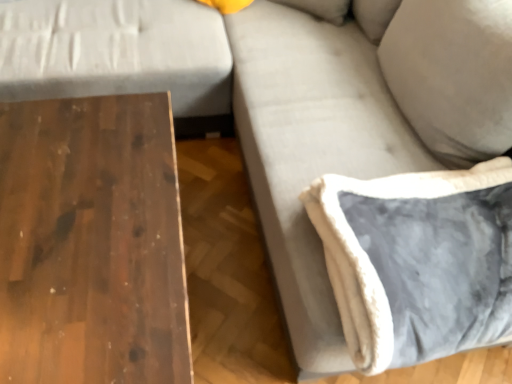
Identify the location of velvet gray pillow at lower right. (418, 261).

In order to face velvet gray pillow at lower right, should I rotate leftwards or rightwards?

Turn right by 24.224 degrees to look at velvet gray pillow at lower right.

What do you see at coordinates (418, 261) in the screenshot? Image resolution: width=512 pixels, height=384 pixels. I see `velvet gray pillow at lower right` at bounding box center [418, 261].

Consider the image. In order to face dark wood table at left, should I rotate leftwards or rightwards?

Rotate your view left by about 23.873°.

What is the approximate width of dark wood table at left?

dark wood table at left is 34.92 inches wide.

What do you see at coordinates (91, 243) in the screenshot? The height and width of the screenshot is (384, 512). I see `dark wood table at left` at bounding box center [91, 243].

The height and width of the screenshot is (384, 512). In order to click on dark wood table at left in this screenshot , I will do `click(91, 243)`.

Identify the location of velvet gray pillow at lower right. The image size is (512, 384). (418, 261).

Which object is positioned more to the left, velvet gray pillow at lower right or dark wood table at left?

From the viewer's perspective, dark wood table at left appears more on the left side.

Considering the relative positions of velvet gray pillow at lower right and dark wood table at left in the image provided, is velvet gray pillow at lower right behind dark wood table at left?

Yes, it is.

Considering the positions of point (490, 308) and point (120, 372), is point (490, 308) closer or farther from the camera than point (120, 372)?

Point (490, 308) appears to be farther away from the viewer than point (120, 372).

From the image's perspective, would you say velvet gray pillow at lower right is positioned over dark wood table at left?

Yes, from the image's perspective, velvet gray pillow at lower right is on top of dark wood table at left.

From a real-world perspective, which is physically below, velvet gray pillow at lower right or dark wood table at left?

dark wood table at left is physically lower.

Considering the sizes of objects velvet gray pillow at lower right and dark wood table at left in the image provided, who is thinner, velvet gray pillow at lower right or dark wood table at left?

With smaller width is velvet gray pillow at lower right.

Is velvet gray pillow at lower right taller than dark wood table at left?

No, velvet gray pillow at lower right is not taller than dark wood table at left.

Considering the relative sizes of velvet gray pillow at lower right and dark wood table at left in the image provided, is velvet gray pillow at lower right bigger than dark wood table at left?

Actually, velvet gray pillow at lower right might be smaller than dark wood table at left.

Can we say velvet gray pillow at lower right lies outside dark wood table at left?

Yes, velvet gray pillow at lower right is located beyond the bounds of dark wood table at left.

Is velvet gray pillow at lower right in contact with dark wood table at left?

There is a gap between velvet gray pillow at lower right and dark wood table at left.

Is velvet gray pillow at lower right facing away from dark wood table at left?

A: velvet gray pillow at lower right is not turned away from dark wood table at left.

What's the angular difference between velvet gray pillow at lower right and dark wood table at left's facing directions?

They differ by 1.59 degrees in their facing directions.

This screenshot has width=512, height=384. Identify the location of table on the left of the velvet gray pillow at lower right. (91, 243).

Does dark wood table at left appear on the right side of velvet gray pillow at lower right?

No, dark wood table at left is not to the right of velvet gray pillow at lower right.

Is the position of dark wood table at left less distant than that of velvet gray pillow at lower right?

Yes, it is in front of velvet gray pillow at lower right.

Is point (74, 265) positioned behind point (480, 163)?

No, it is in front of (480, 163).

From the image's perspective, is dark wood table at left located above or below velvet gray pillow at lower right?

dark wood table at left is situated lower than velvet gray pillow at lower right in the image.

From a real-world perspective, is dark wood table at left over velvet gray pillow at lower right?

No, from a real-world perspective, dark wood table at left is not on top of velvet gray pillow at lower right.

Considering the sizes of objects dark wood table at left and velvet gray pillow at lower right in the image provided, who is thinner, dark wood table at left or velvet gray pillow at lower right?

Thinner between the two is velvet gray pillow at lower right.

Considering the relative sizes of dark wood table at left and velvet gray pillow at lower right in the image provided, is dark wood table at left taller than velvet gray pillow at lower right?

Correct, dark wood table at left is much taller as velvet gray pillow at lower right.

Does dark wood table at left have a smaller size compared to velvet gray pillow at lower right?

Incorrect, dark wood table at left is not smaller in size than velvet gray pillow at lower right.

Is dark wood table at left inside or outside of velvet gray pillow at lower right?

dark wood table at left is spatially situated outside velvet gray pillow at lower right.

Would you consider dark wood table at left to be distant from velvet gray pillow at lower right?

No, dark wood table at left is in close proximity to velvet gray pillow at lower right.

Based on the photo, is dark wood table at left aimed at velvet gray pillow at lower right?

No.

Locate an element on the screen. table lying on the left of velvet gray pillow at lower right is located at coordinates (91, 243).

You are a GUI agent. You are given a task and a screenshot of the screen. Output one action in this format:
    pyautogui.click(x=<x>, y=<y>)
    Task: Click on the table that appears in front of the velvet gray pillow at lower right
    The height and width of the screenshot is (384, 512).
    Given the screenshot: What is the action you would take?
    pyautogui.click(x=91, y=243)

The width and height of the screenshot is (512, 384). Identify the location of table below the velvet gray pillow at lower right (from the image's perspective). (91, 243).